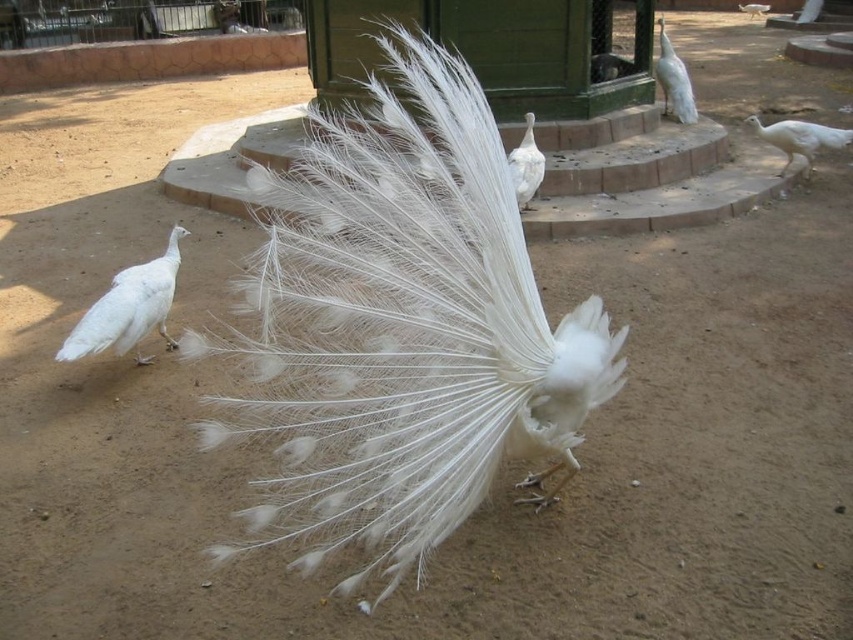
Question: Which is farther from the white feathered peacock at upper right?

Choices:
 (A) white feathered peacock at right
 (B) white feathered peacock at left

Answer: (B)

Question: Considering the real-world distances, which object is farthest from the white feathered peacock at center?

Choices:
 (A) white feathered bird at center
 (B) white feathered peacock at left

Answer: (A)

Question: Is white feathered peacock at center thinner than white feathered bird at center?

Choices:
 (A) yes
 (B) no

Answer: (B)

Question: Which object is positioned farthest from the white feathered peacock at left?

Choices:
 (A) white feathered peacock at center
 (B) white feathered bird at upper right
 (C) white feathered bird at center
 (D) white feathered peacock at right

Answer: (B)

Question: Can you confirm if white feathered peacock at left is bigger than white feathered bird at center?

Choices:
 (A) yes
 (B) no

Answer: (B)

Question: Does white feathered peacock at upper right appear over white feathered bird at upper right?

Choices:
 (A) yes
 (B) no

Answer: (B)